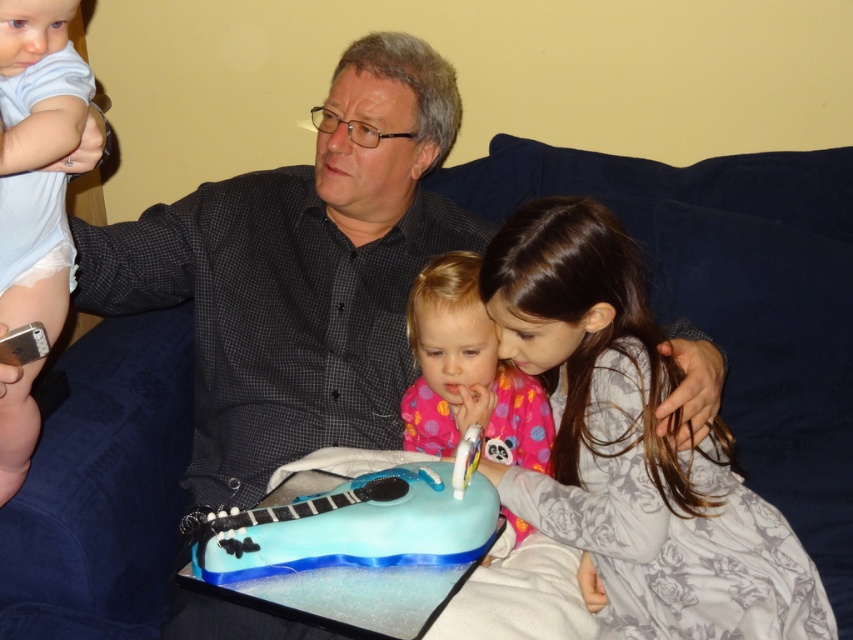
Which is in front, point (479, 372) or point (47, 308)?

Point (47, 308) is more forward.

The height and width of the screenshot is (640, 853). What are the coordinates of `pink fabric at center` in the screenshot? It's located at (467, 372).

The width and height of the screenshot is (853, 640). What do you see at coordinates (631, 448) in the screenshot?
I see `fluffy gray dress at lower right` at bounding box center [631, 448].

You are a GUI agent. You are given a task and a screenshot of the screen. Output one action in this format:
    pyautogui.click(x=<x>, y=<y>)
    Task: Click on the fluffy gray dress at lower right
    Image resolution: width=853 pixels, height=640 pixels.
    Given the screenshot: What is the action you would take?
    pyautogui.click(x=631, y=448)

Can you confirm if fluffy gray dress at lower right is wider than pink fabric at center?

Correct, the width of fluffy gray dress at lower right exceeds that of pink fabric at center.

Who is positioned more to the left, fluffy gray dress at lower right or pink fabric at center?

pink fabric at center is more to the left.

Find the location of a particular element. The width and height of the screenshot is (853, 640). fluffy gray dress at lower right is located at coordinates (631, 448).